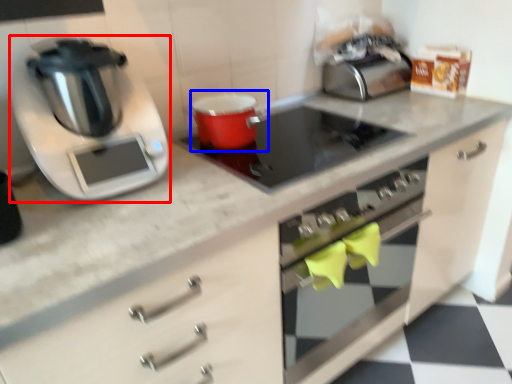
Question: Which object is closer to the camera taking this photo, kitchen appliance (highlighted by a red box) or appliance (highlighted by a blue box)?

Choices:
 (A) kitchen appliance
 (B) appliance

Answer: (A)